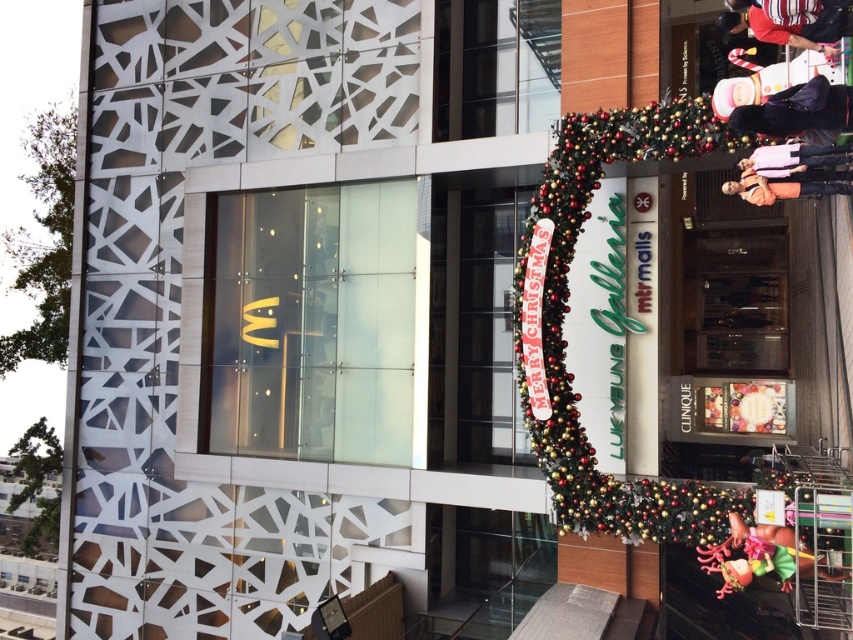
Which is behind, point (804, 552) or point (770, 172)?

Point (770, 172)

Identify the location of shiny metallic santa claus at lower right. (761, 556).

Does point (788, 573) lie in front of point (772, 164)?

No, it is behind (772, 164).

Identify the location of shiny metallic santa claus at lower right. This screenshot has width=853, height=640. tap(761, 556).

Who is positioned more to the right, gold metallic garland at center right or white fabric at upper right?

white fabric at upper right is more to the right.

Which is more to the left, gold metallic garland at center right or white fabric at upper right?

From the viewer's perspective, gold metallic garland at center right appears more on the left side.

You are a GUI agent. You are given a task and a screenshot of the screen. Output one action in this format:
    pyautogui.click(x=<x>, y=<y>)
    Task: Click on the gold metallic garland at center right
    
    Given the screenshot: What is the action you would take?
    pyautogui.click(x=567, y=308)

This screenshot has width=853, height=640. I want to click on gold metallic garland at center right, so point(567,308).

What do you see at coordinates (567, 308) in the screenshot? This screenshot has height=640, width=853. I see `gold metallic garland at center right` at bounding box center [567, 308].

Does gold metallic garland at center right appear on the right side of dark blue jacket at upper right?

Incorrect, gold metallic garland at center right is not on the right side of dark blue jacket at upper right.

Describe the element at coordinates (567, 308) in the screenshot. I see `gold metallic garland at center right` at that location.

Where is `gold metallic garland at center right`? This screenshot has width=853, height=640. gold metallic garland at center right is located at coordinates (567, 308).